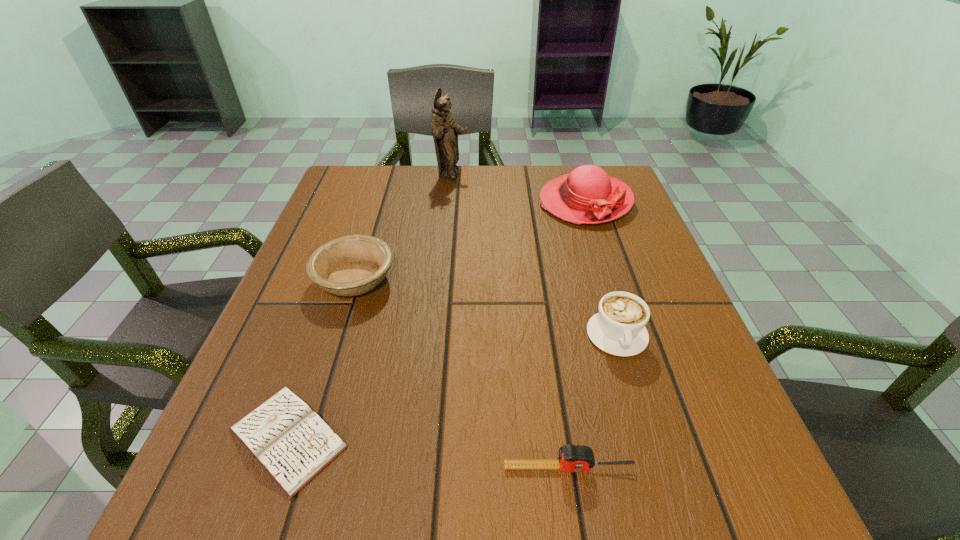
Find the location of a particular element. The image size is (960, 540). free space at the far right corner of the desktop is located at coordinates (635, 210).

Where is `vacant point located between the shortest object and the tape measure`? The height and width of the screenshot is (540, 960). vacant point located between the shortest object and the tape measure is located at coordinates (428, 452).

Image resolution: width=960 pixels, height=540 pixels. Identify the location of free space between the shortest object and the tape measure. (428, 452).

Identify the location of free spot between the second tallest object and the diary. (437, 319).

The height and width of the screenshot is (540, 960). Identify the location of free space between the fifth tallest object and the third tallest object. coord(593,401).

The height and width of the screenshot is (540, 960). Find the location of `vacant area that lies between the diary and the tape measure`. vacant area that lies between the diary and the tape measure is located at coordinates (428, 452).

Find the location of `free spot between the fifth tallest object and the fourth object from right to left`. free spot between the fifth tallest object and the fourth object from right to left is located at coordinates (510, 321).

Image resolution: width=960 pixels, height=540 pixels. Find the location of `vacant space that's between the cappuccino and the hat`. vacant space that's between the cappuccino and the hat is located at coordinates (601, 268).

This screenshot has width=960, height=540. Find the location of `free space that is in between the fifth tallest object and the shortest object`. free space that is in between the fifth tallest object and the shortest object is located at coordinates (428, 452).

Identify the location of vacant region between the fifth tallest object and the figurine. Image resolution: width=960 pixels, height=540 pixels. (510, 321).